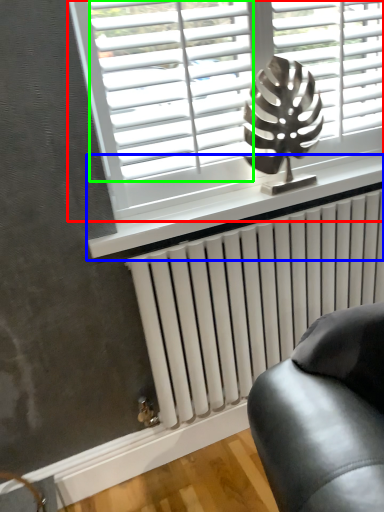
Question: Which object is positioned closest to window (highlighted by a red box)? Select from window sill (highlighted by a blue box) and blind (highlighted by a green box).

Choices:
 (A) window sill
 (B) blind

Answer: (B)